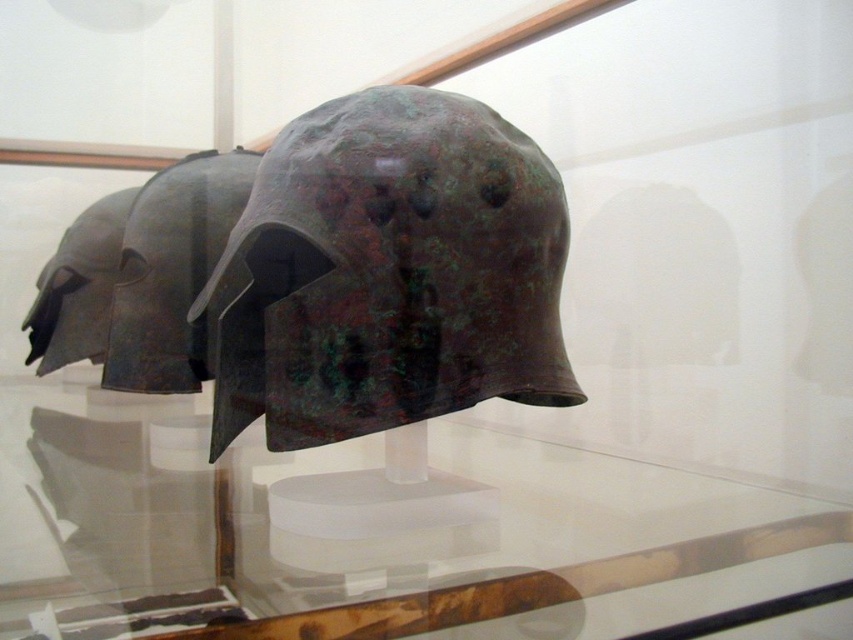
Question: Is transparent glass table at center to the right of green patina metal helmet at center from the viewer's perspective?

Choices:
 (A) yes
 (B) no

Answer: (B)

Question: Does transparent glass table at center lie behind green patina metal helmet at center?

Choices:
 (A) yes
 (B) no

Answer: (B)

Question: Which point is farther from the camera taking this photo?

Choices:
 (A) (253, 454)
 (B) (349, 150)

Answer: (A)

Question: Can you confirm if transparent glass table at center is positioned above green patina metal helmet at center?

Choices:
 (A) yes
 (B) no

Answer: (B)

Question: Which object appears farthest from the camera in this image?

Choices:
 (A) green patina metal helmet at center
 (B) transparent glass table at center

Answer: (A)